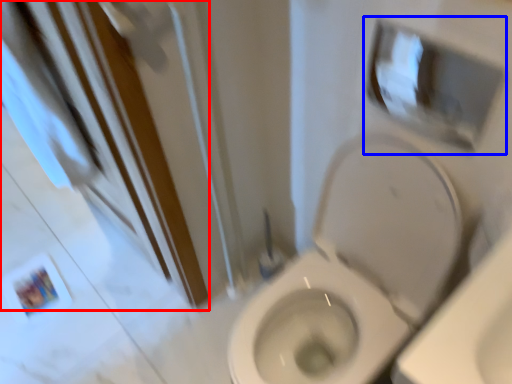
Question: Which of the following is the closest to the observer, screen door (highlighted by a red box) or medicine cabinet (highlighted by a blue box)?

Choices:
 (A) screen door
 (B) medicine cabinet

Answer: (A)